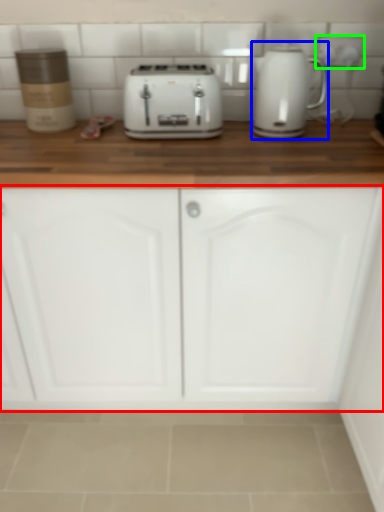
Question: Which is farther away from cabinetry (highlighted by a red box)? home appliance (highlighted by a blue box) or electric outlet (highlighted by a green box)?

Choices:
 (A) home appliance
 (B) electric outlet

Answer: (B)